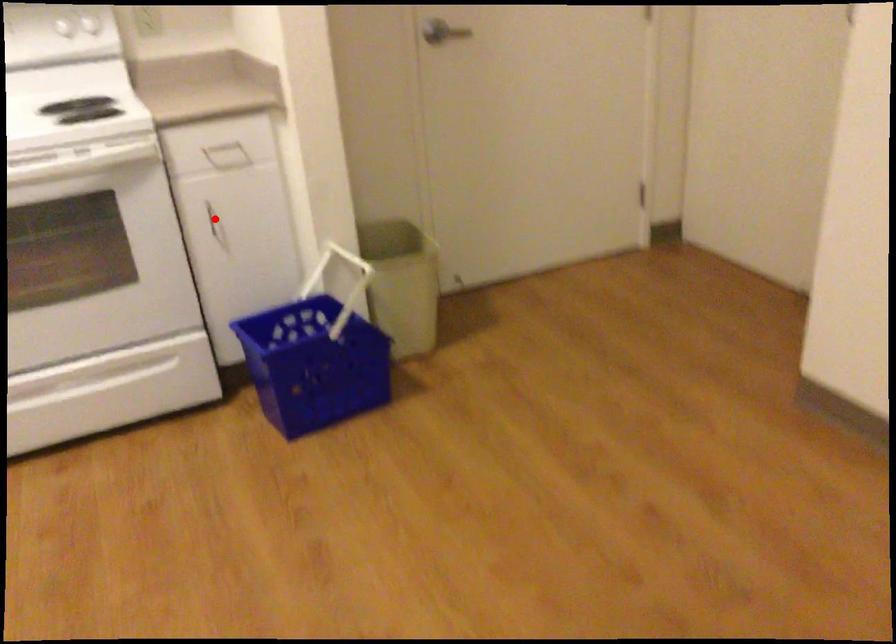
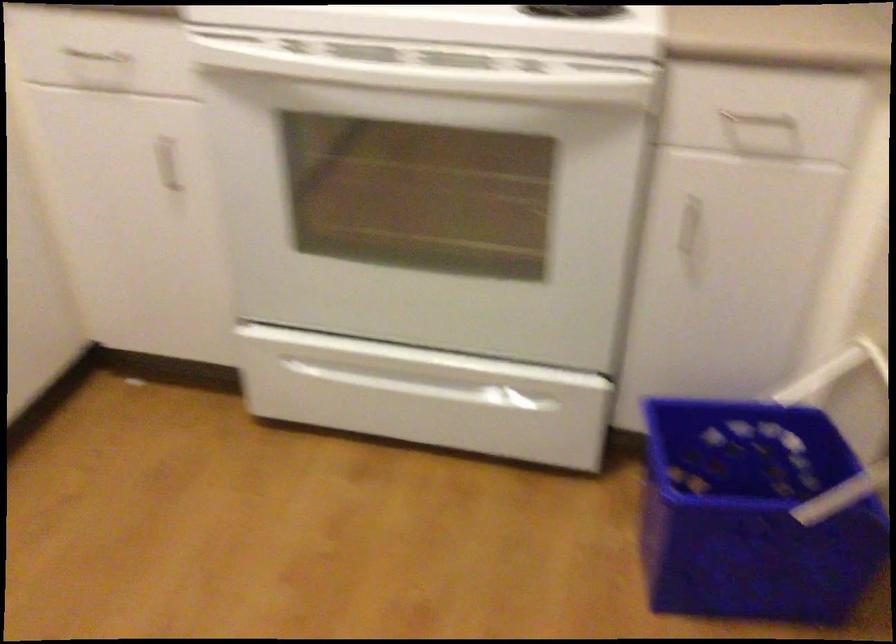
The point at the highlighted location is marked in the first image. Where is the corresponding point in the second image?

(691, 228)